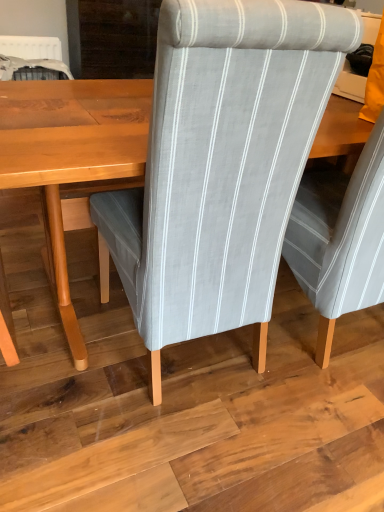
Question: Should I look upward or downward to see light gray fabric chair at center?

Choices:
 (A) down
 (B) up

Answer: (B)